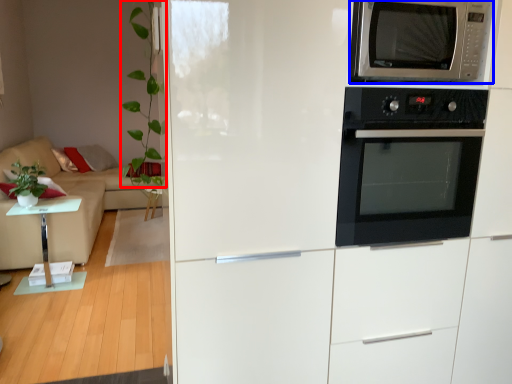
Question: Which of the following is the farthest to the observer, plant (highlighted by a red box) or microwave oven (highlighted by a blue box)?

Choices:
 (A) plant
 (B) microwave oven

Answer: (A)